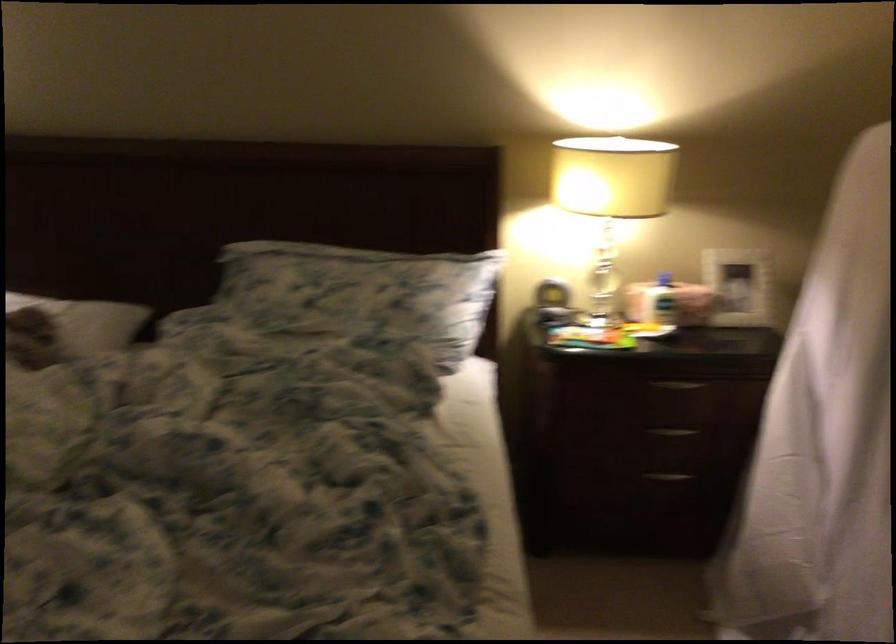
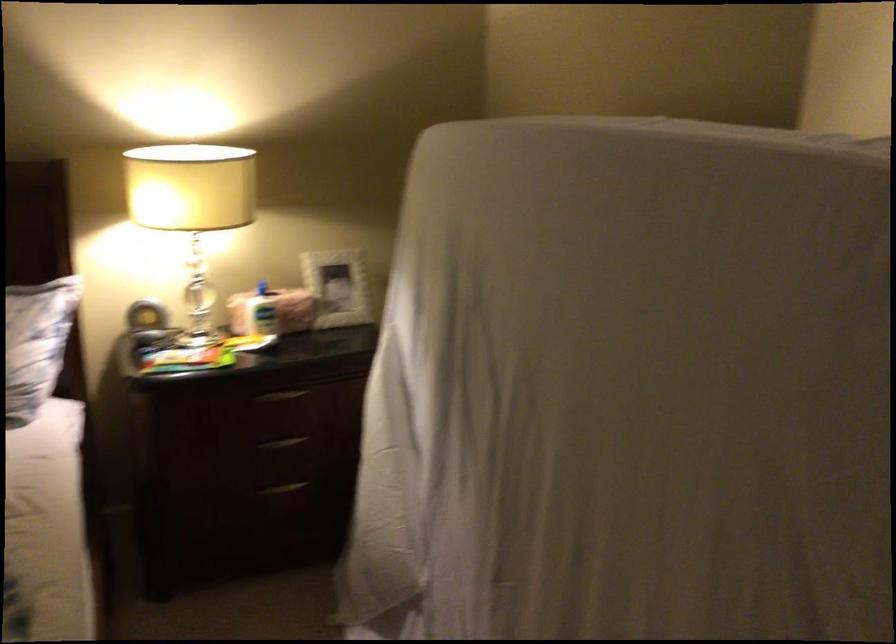
Where in the second image is the point corresponding to pixel 674 428 from the first image?

(282, 442)